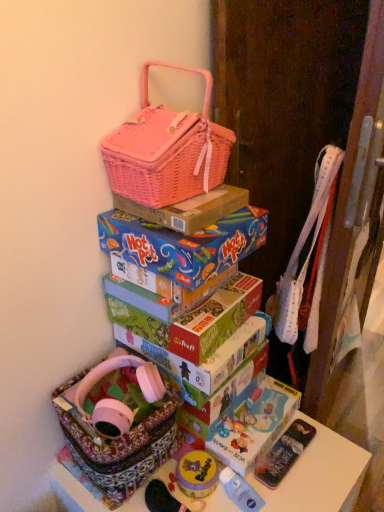
Question: From a real-world perspective, is matte plastic toy at lower center above or below blue cardboard hot pot box at center, which appears as the second box when viewed from the top?

Choices:
 (A) above
 (B) below

Answer: (B)

Question: Does point (248, 501) appear closer or farther from the camera than point (167, 227)?

Choices:
 (A) farther
 (B) closer

Answer: (A)

Question: Estimate the real-world distances between objects in this image. Which object is farther from the blue cardboard hot pot box at center, placed as the 1th box when sorted from bottom to top?

Choices:
 (A) matte plastic toy at lower center
 (B) floral fabric basket at lower left
 (C) pink wicker basket at upper center
 (D) patterned fabric basket at lower left
 (E) pink wicker basket at upper center, which is the first box in top-to-bottom order

Answer: (A)

Question: Based on their relative distances, which object is farther from the blue cardboard hot pot box at center, placed as the 1th box when sorted from bottom to top?

Choices:
 (A) floral fabric basket at lower left
 (B) matte plastic toy at lower center
 (C) pink wicker basket at upper center
 (D) pink wicker basket at upper center, which is the first box in top-to-bottom order
 (E) patterned fabric basket at lower left

Answer: (B)